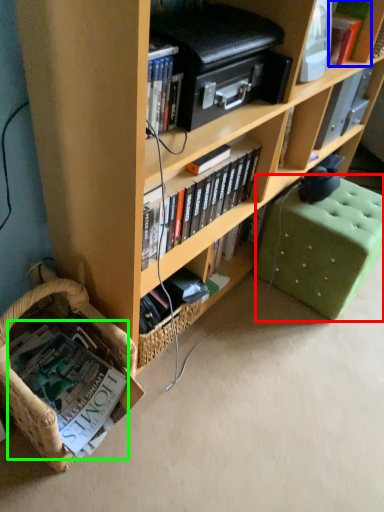
Question: Which object is positioned closest to swivel chair (highlighted by a red box)? Select from book (highlighted by a blue box) and book (highlighted by a green box).

Choices:
 (A) book
 (B) book

Answer: (A)